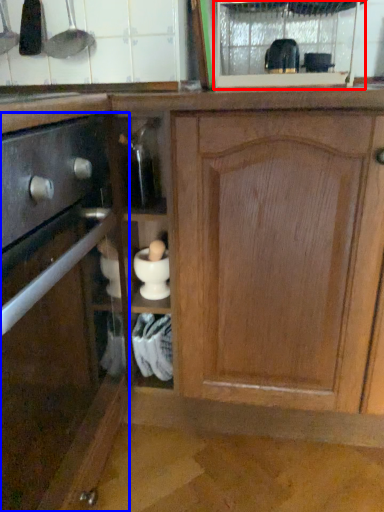
Question: Which of the following is the closest to the observer, glass door (highlighted by a red box) or cabinetry (highlighted by a blue box)?

Choices:
 (A) glass door
 (B) cabinetry

Answer: (B)